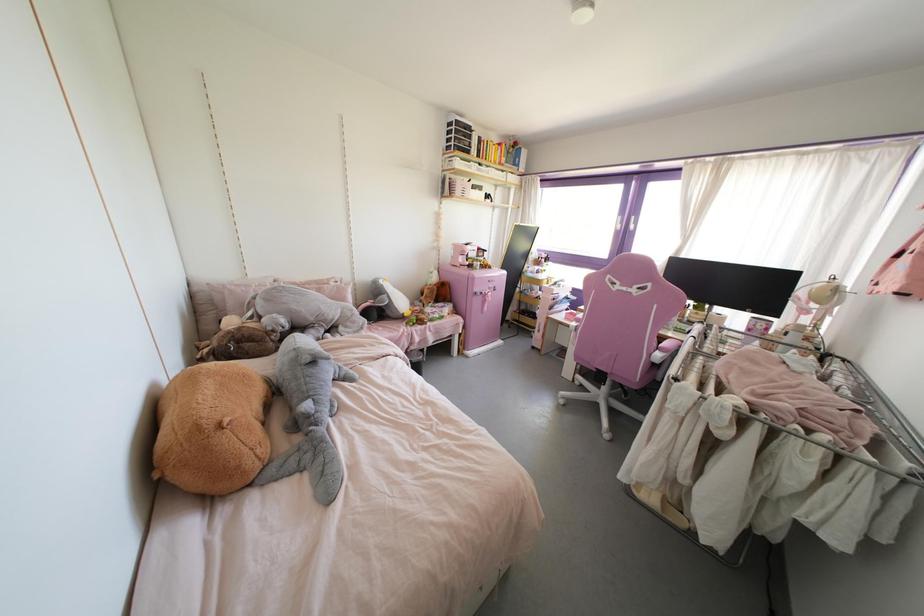
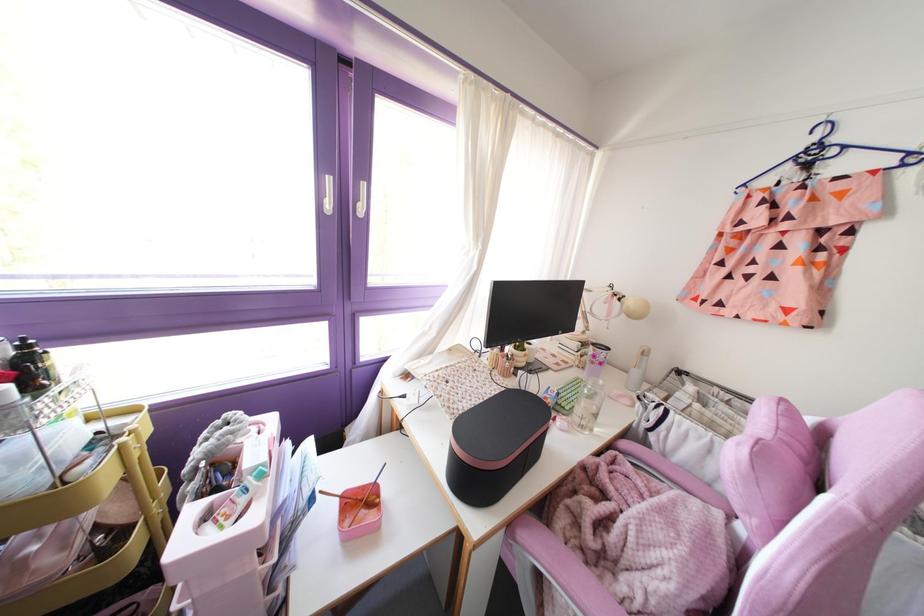
In the second image, find the point that corresponds to pixel 617 225 in the first image.

(329, 205)